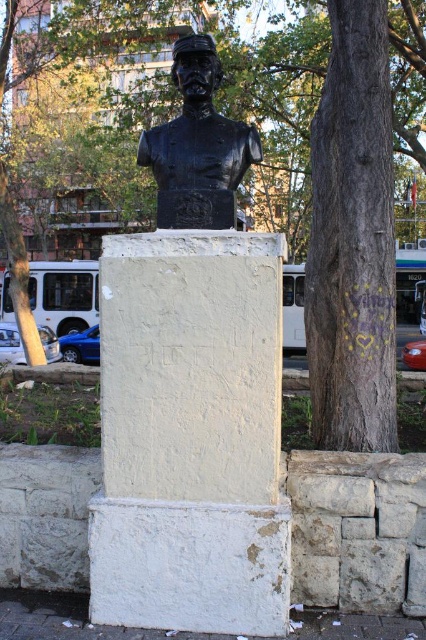
You are standing in front of the bust sculpture on the white pedestal. There is a green textured tree at center right. Where is the green textured tree located in relation to the bust sculpture?

The green textured tree at center right is located at coordinates point (275, 67) relative to the bust sculpture.